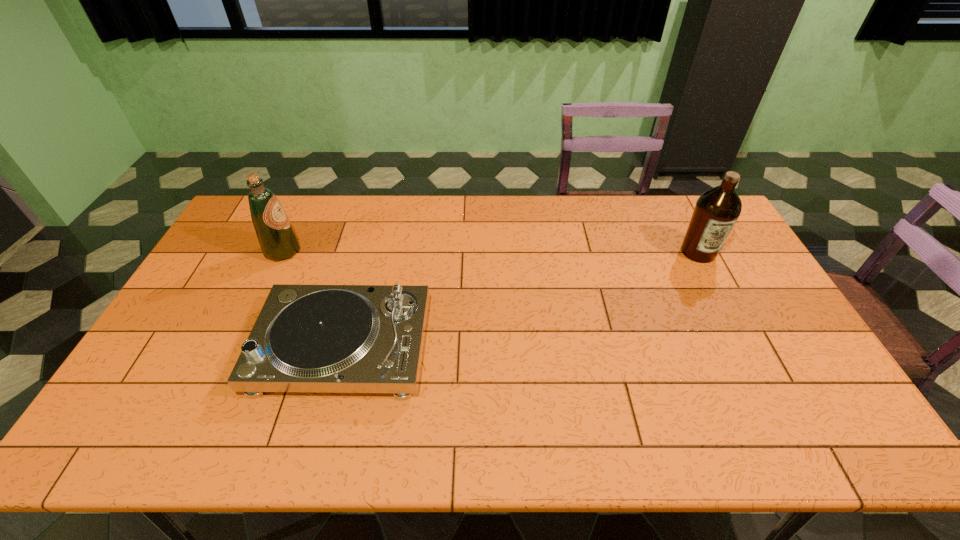
Locate which object is the second closest to the left olive oil. Please provide its 2D coordinates. Your answer should be formatted as a tuple, i.e. [(x, y)], where the tuple contains the x and y coordinates of a point satisfying the conditions above.

[(716, 211)]

Identify the location of object that is the closest to the right olive oil. The image size is (960, 540). (307, 338).

The width and height of the screenshot is (960, 540). Identify the location of vacant space that satisfies the following two spatial constraints: 1. on the front-facing side of the left olive oil; 2. on the left side of the record player. (238, 346).

I want to click on vacant area that satisfies the following two spatial constraints: 1. on the front-facing side of the record player; 2. on the right side of the left olive oil, so click(x=238, y=346).

Find the location of `free space that satisfies the following two spatial constraints: 1. on the front-facing side of the left olive oil; 2. on the left side of the nearest object`. free space that satisfies the following two spatial constraints: 1. on the front-facing side of the left olive oil; 2. on the left side of the nearest object is located at coordinates (238, 346).

Image resolution: width=960 pixels, height=540 pixels. Find the location of `blank space that satisfies the following two spatial constraints: 1. on the front-facing side of the left olive oil; 2. on the right side of the shortest object`. blank space that satisfies the following two spatial constraints: 1. on the front-facing side of the left olive oil; 2. on the right side of the shortest object is located at coordinates (238, 346).